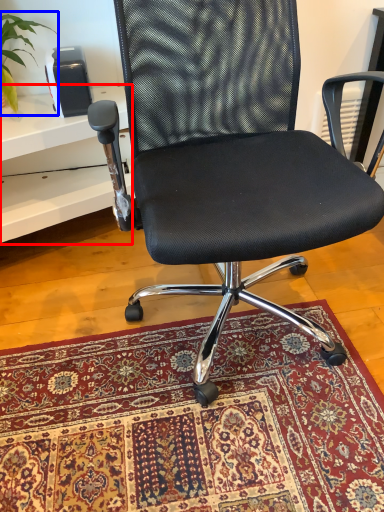
Question: Among these objects, which one is nearest to the camera, table (highlighted by a red box) or plant (highlighted by a blue box)?

Choices:
 (A) table
 (B) plant

Answer: (A)